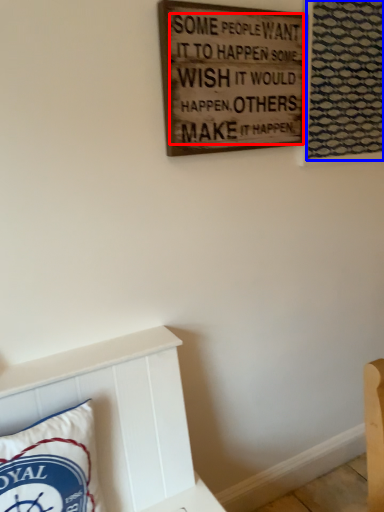
Question: Which of the following is the closest to the observer, writing (highlighted by a red box) or tapestry (highlighted by a blue box)?

Choices:
 (A) writing
 (B) tapestry

Answer: (A)